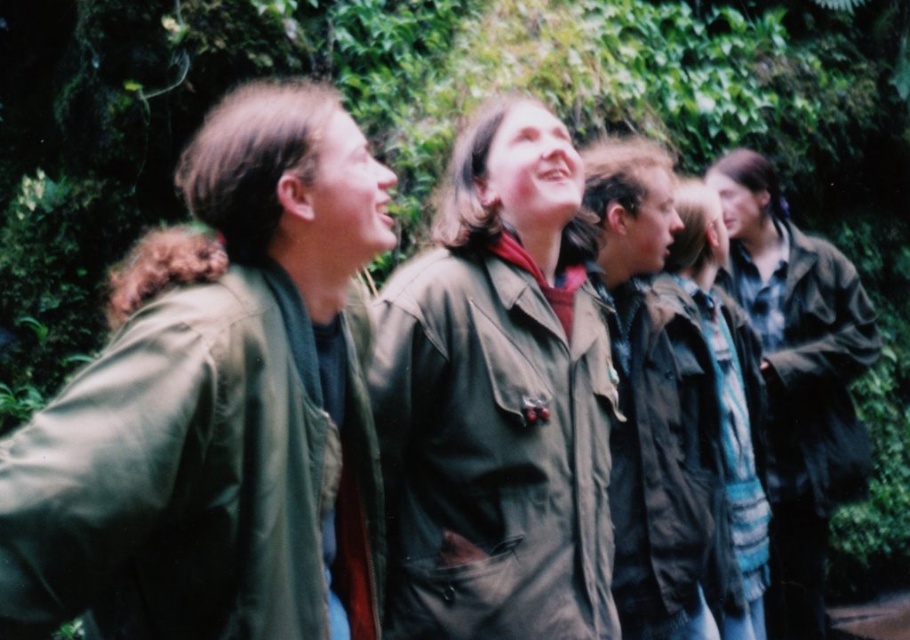
Question: Can you confirm if green canvas jacket at center is positioned to the right of dark green textured jacket at center?

Choices:
 (A) yes
 (B) no

Answer: (B)

Question: Which of these objects is positioned closest to the green matte trench coat at left?

Choices:
 (A) matte brown jacket at center
 (B) green canvas jacket at center
 (C) dark brown leather jacket at right
 (D) dark green textured jacket at center

Answer: (B)

Question: Can you confirm if green canvas jacket at center is positioned to the left of dark green textured jacket at center?

Choices:
 (A) yes
 (B) no

Answer: (A)

Question: Which object appears closest to the camera in this image?

Choices:
 (A) green canvas jacket at center
 (B) dark green textured jacket at center
 (C) green matte trench coat at left
 (D) matte brown jacket at center

Answer: (C)

Question: Estimate the real-world distances between objects in this image. Which object is farther from the dark brown leather jacket at right?

Choices:
 (A) green canvas jacket at center
 (B) green matte trench coat at left

Answer: (B)

Question: Is green canvas jacket at center bigger than matte brown jacket at center?

Choices:
 (A) yes
 (B) no

Answer: (A)